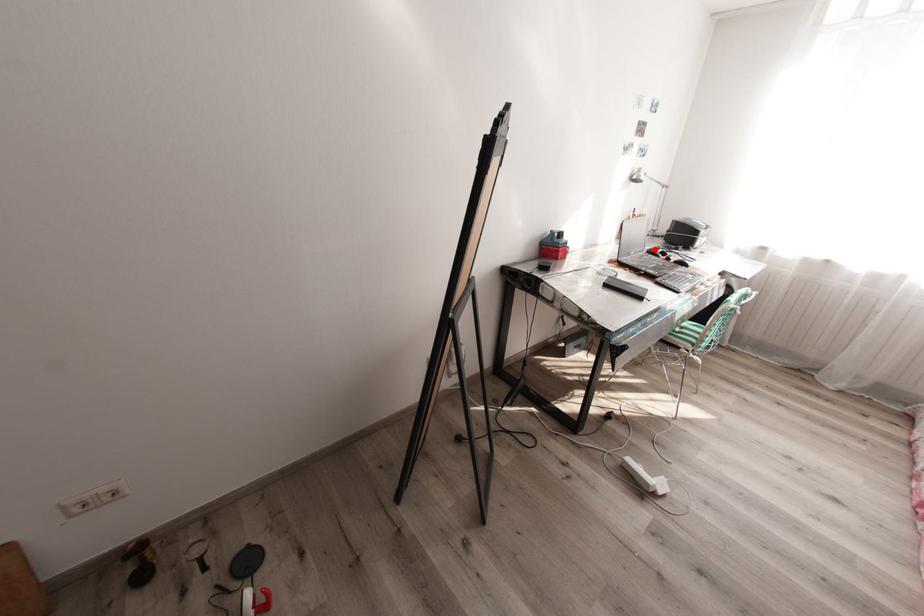
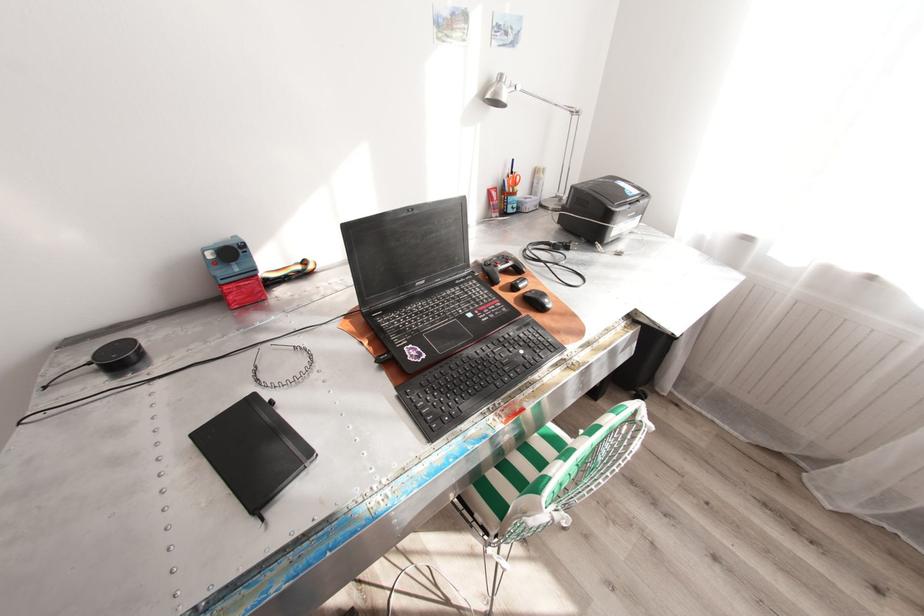
Where in the second image is the point corresponding to the highlighted location from the first image?

(490, 264)